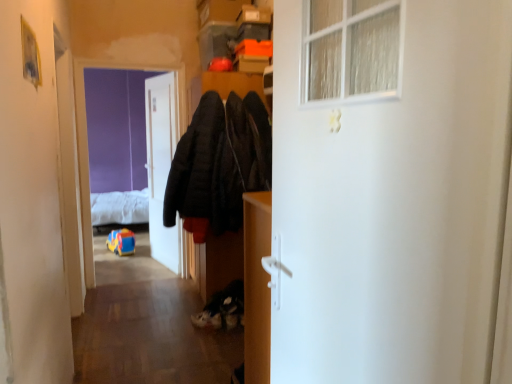
Where is `vacant point above purple matte screen door at upper left (from a real-world perspective)`? vacant point above purple matte screen door at upper left (from a real-world perspective) is located at coordinates (131, 60).